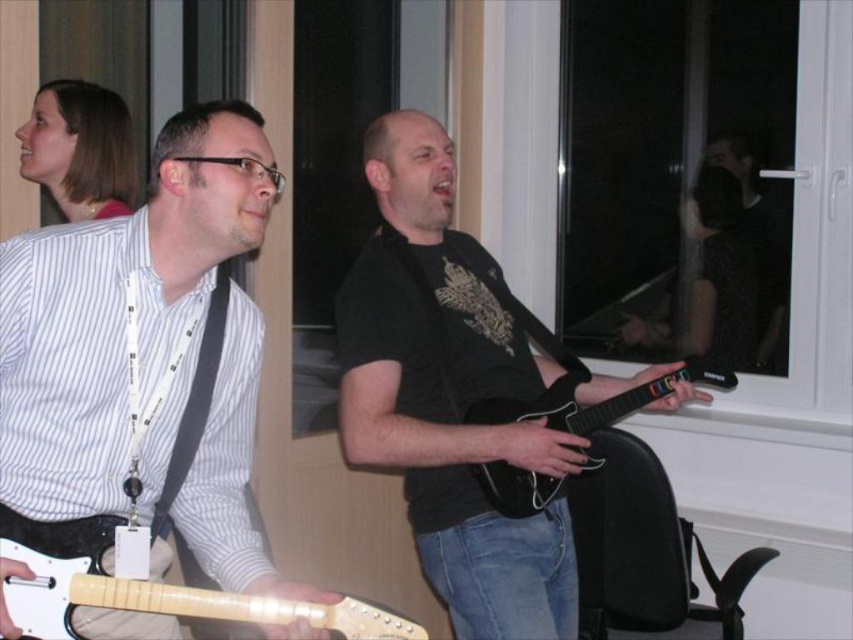
Who is shorter, white glossy guitar at left or black matte guitar at center?

With less height is white glossy guitar at left.

Is white glossy guitar at left shorter than black matte guitar at center?

Yes.

Is point (38, 250) closer to viewer compared to point (403, 307)?

That is True.

The height and width of the screenshot is (640, 853). In order to click on white glossy guitar at left in this screenshot , I will do `click(120, 316)`.

Measure the distance from black matte guitar at center to black glossy electric guitar at center.

14.57 centimeters

Is black matte guitar at center above black glossy electric guitar at center?

Indeed, black matte guitar at center is positioned over black glossy electric guitar at center.

Who is more forward, (x=679, y=385) or (x=659, y=397)?

Point (x=679, y=385)

The height and width of the screenshot is (640, 853). I want to click on black matte guitar at center, so click(x=450, y=396).

Describe the element at coordinates (120, 316) in the screenshot. I see `white glossy guitar at left` at that location.

Does white glossy guitar at left appear under light wood electric guitar at lower left?

No.

Where is `white glossy guitar at left`? The height and width of the screenshot is (640, 853). white glossy guitar at left is located at coordinates (120, 316).

I want to click on white glossy guitar at left, so click(120, 316).